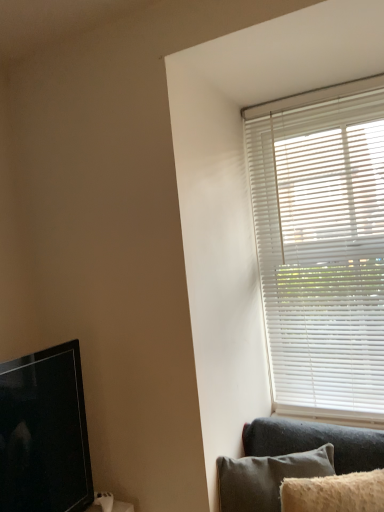
Question: Considering the relative positions of black glossy tv at left and fuzzy beige pillow at lower right in the image provided, is black glossy tv at left behind fuzzy beige pillow at lower right?

Choices:
 (A) yes
 (B) no

Answer: (B)

Question: From the image's perspective, does black glossy tv at left appear higher than fuzzy beige pillow at lower right?

Choices:
 (A) no
 (B) yes

Answer: (B)

Question: Is black glossy tv at left oriented away from fuzzy beige pillow at lower right?

Choices:
 (A) yes
 (B) no

Answer: (B)

Question: From a real-world perspective, is black glossy tv at left physically below fuzzy beige pillow at lower right?

Choices:
 (A) no
 (B) yes

Answer: (A)

Question: Considering the relative sizes of black glossy tv at left and fuzzy beige pillow at lower right in the image provided, is black glossy tv at left thinner than fuzzy beige pillow at lower right?

Choices:
 (A) no
 (B) yes

Answer: (A)

Question: Is point (289, 426) closer or farther from the camera than point (296, 509)?

Choices:
 (A) closer
 (B) farther

Answer: (B)

Question: From a real-world perspective, relative to fuzzy beige pillow at lower right, is dark gray fabric couch at lower right vertically above or below?

Choices:
 (A) below
 (B) above

Answer: (A)

Question: Is dark gray fabric couch at lower right in front of or behind fuzzy beige pillow at lower right in the image?

Choices:
 (A) front
 (B) behind

Answer: (B)

Question: Considering the positions of dark gray fabric couch at lower right and fuzzy beige pillow at lower right in the image, is dark gray fabric couch at lower right bigger or smaller than fuzzy beige pillow at lower right?

Choices:
 (A) big
 (B) small

Answer: (A)

Question: Considering the positions of black glossy tv at left and white matte blinds at upper right in the image, is black glossy tv at left taller or shorter than white matte blinds at upper right?

Choices:
 (A) tall
 (B) short

Answer: (B)

Question: Considering the positions of black glossy tv at left and white matte blinds at upper right in the image, is black glossy tv at left bigger or smaller than white matte blinds at upper right?

Choices:
 (A) small
 (B) big

Answer: (A)

Question: Does point click(51, 373) appear closer or farther from the camera than point click(322, 333)?

Choices:
 (A) closer
 (B) farther

Answer: (A)

Question: Visually, is black glossy tv at left positioned to the left or to the right of white matte blinds at upper right?

Choices:
 (A) right
 (B) left

Answer: (B)

Question: From a real-world perspective, relative to fuzzy beige pillow at lower right, is white matte blinds at upper right vertically above or below?

Choices:
 (A) above
 (B) below

Answer: (A)

Question: Considering the positions of white matte blinds at upper right and fuzzy beige pillow at lower right in the image, is white matte blinds at upper right taller or shorter than fuzzy beige pillow at lower right?

Choices:
 (A) tall
 (B) short

Answer: (A)